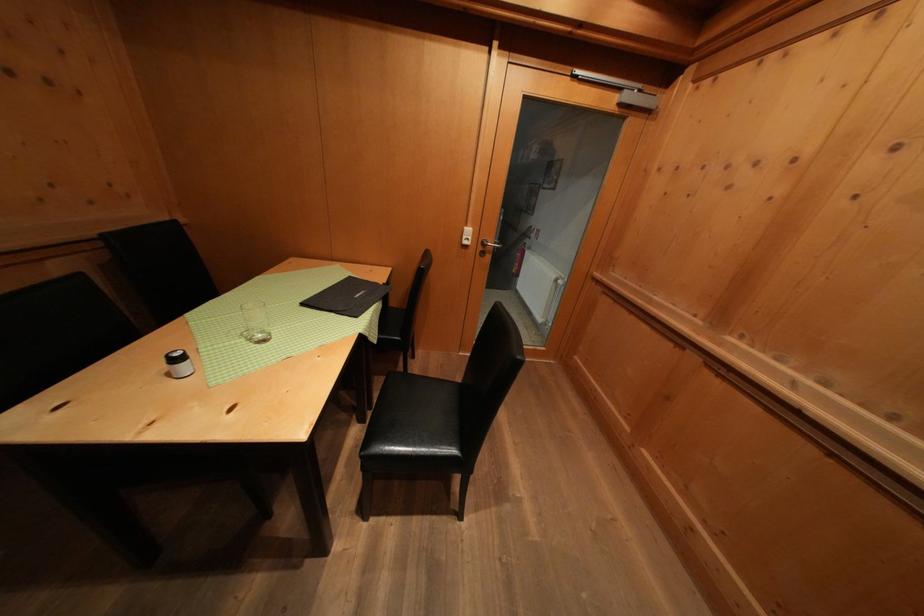
Identify the location of black chair sitting surface. (419, 411).